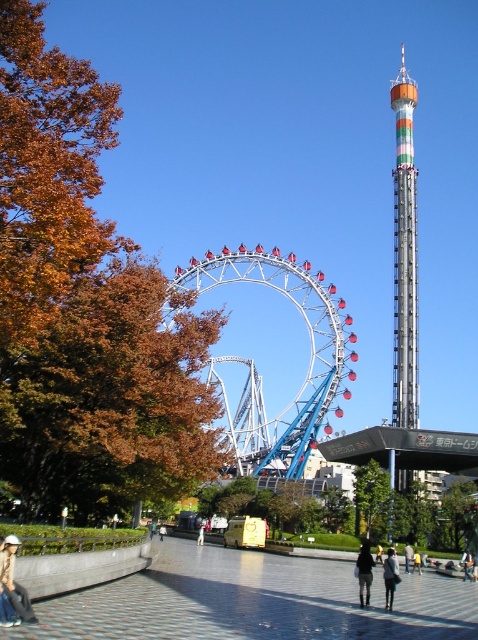
From the picture: You are a photographer trying to capture a photo of the Ferris wheel without any people in the frame. You notice a light brown leather jacket at lower left and dark blue jeans at center. Which of these two items is closer to the Ferris wheel?

The light brown leather jacket at lower left is located above the dark blue jeans at center, so it is closer to the Ferris wheel.